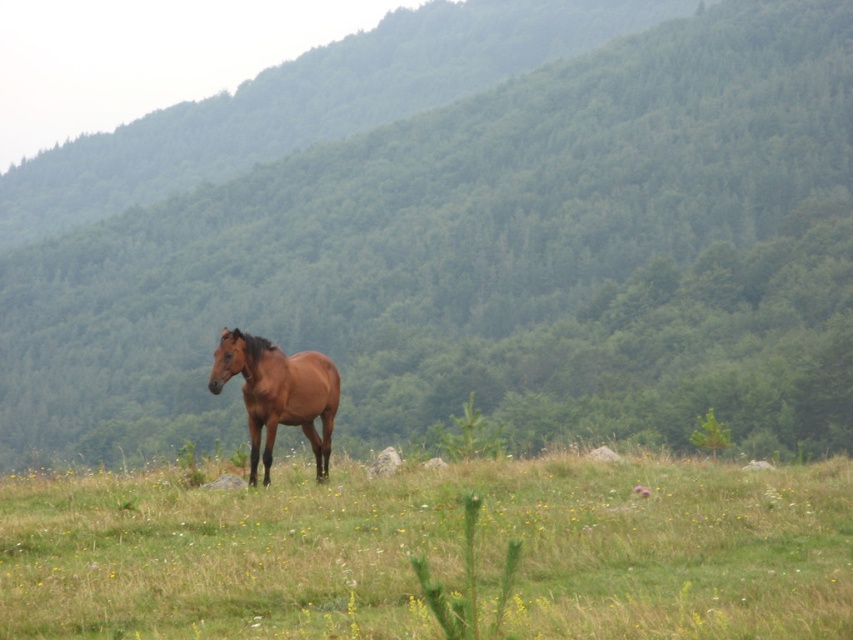
Can you confirm if green forested mountain at center is taller than brown glossy horse at center?

Yes.

The height and width of the screenshot is (640, 853). I want to click on green forested mountain at center, so click(486, 259).

Is point (619, 269) in front of point (247, 408)?

No, it is not.

I want to click on green forested mountain at center, so click(x=486, y=259).

Does green forested mountain at center have a smaller size compared to green grass at center?

No.

What do you see at coordinates (486, 259) in the screenshot? The width and height of the screenshot is (853, 640). I see `green forested mountain at center` at bounding box center [486, 259].

Who is more forward, (144, 451) or (555, 624)?

Point (555, 624) is in front.

At what (x,y) coordinates should I click in order to perform the action: click on green forested mountain at center. Please return your answer as a coordinate pair (x, y). The image size is (853, 640). Looking at the image, I should click on (486, 259).

Is green grass at center positioned behind brown glossy horse at center?

No.

Is point (451, 531) positioned after point (315, 400)?

No, it is not.

What do you see at coordinates (434, 552) in the screenshot?
I see `green grass at center` at bounding box center [434, 552].

The image size is (853, 640). In order to click on green grass at center in this screenshot , I will do `click(434, 552)`.